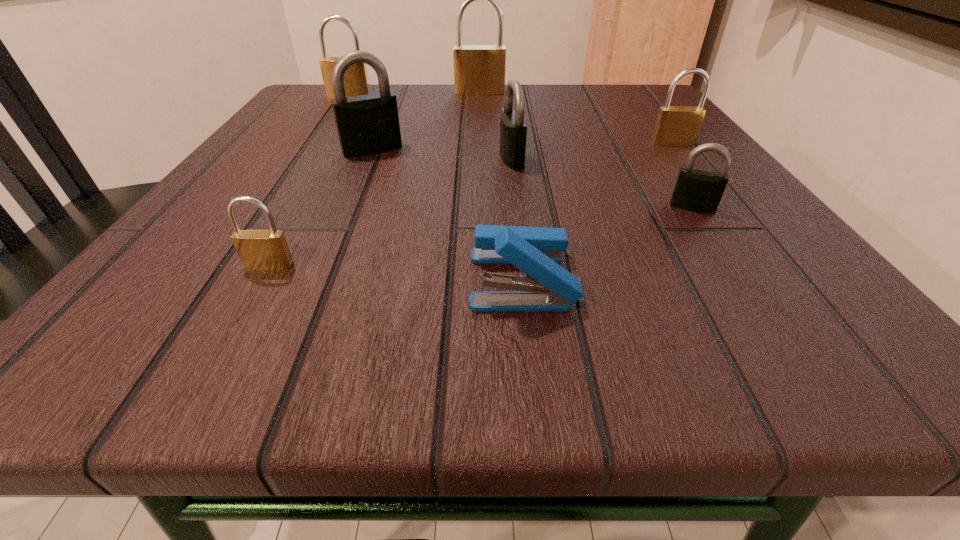
The width and height of the screenshot is (960, 540). What are the coordinates of `vacant region between the leftmost black padlock and the blue stapler` in the screenshot? It's located at (447, 214).

Identify the location of empty space that is in between the second biggest brass padlock and the smallest brass padlock. (309, 181).

Locate an element on the screen. vacant point located between the nearest brass padlock and the third biggest brass padlock is located at coordinates (471, 205).

You are a GUI agent. You are given a task and a screenshot of the screen. Output one action in this format:
    pyautogui.click(x=<x>, y=<y>)
    Task: Click on the object identified as the sixth closest to the tallest padlock
    The image size is (960, 540).
    Given the screenshot: What is the action you would take?
    546,287

You are a GUI agent. You are given a task and a screenshot of the screen. Output one action in this format:
    pyautogui.click(x=<x>, y=<y>)
    Task: Click on the seventh closest object to the biggest brass padlock
    The width and height of the screenshot is (960, 540).
    Given the screenshot: What is the action you would take?
    pyautogui.click(x=266, y=250)

At what (x,y) coordinates should I click in order to perform the action: click on the fourth closest padlock to the third smallest brass padlock. Please return your answer as a coordinate pair (x, y). Looking at the image, I should click on (266, 250).

Identify which padlock is located as the fifth nearest to the second black padlock from left to right. Please provide its 2D coordinates. Your answer should be formatted as a tuple, i.e. [(x, y)], where the tuple contains the x and y coordinates of a point satisfying the conditions above.

[(266, 250)]

Identify the location of brass padlock that is the third nearest to the nearest black padlock. This screenshot has height=540, width=960. (266, 250).

At what (x,y) coordinates should I click in order to perform the action: click on brass padlock that stands as the third closest to the nearest brass padlock. Please return your answer as a coordinate pair (x, y). This screenshot has width=960, height=540. Looking at the image, I should click on (676, 125).

Locate which black padlock ranks in proximity to the nearest black padlock. Please provide its 2D coordinates. Your answer should be formatted as a tuple, i.e. [(x, y)], where the tuple contains the x and y coordinates of a point satisfying the conditions above.

[(513, 130)]